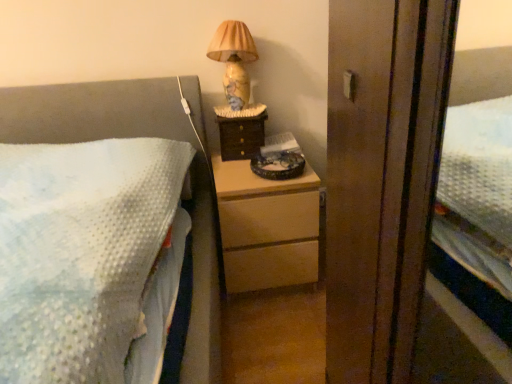
Question: Considering the relative positions of wooden drawer at center and light wood chest of drawers at center in the image provided, is wooden drawer at center to the right of light wood chest of drawers at center from the viewer's perspective?

Choices:
 (A) yes
 (B) no

Answer: (B)

Question: Are wooden drawer at center and light wood chest of drawers at center far apart?

Choices:
 (A) no
 (B) yes

Answer: (A)

Question: From the image's perspective, does wooden drawer at center appear lower than light wood chest of drawers at center?

Choices:
 (A) no
 (B) yes

Answer: (A)

Question: Considering the relative sizes of wooden drawer at center and light wood chest of drawers at center in the image provided, is wooden drawer at center wider than light wood chest of drawers at center?

Choices:
 (A) yes
 (B) no

Answer: (B)

Question: Could light wood chest of drawers at center be considered to be inside wooden drawer at center?

Choices:
 (A) no
 (B) yes

Answer: (A)

Question: Is light wood chest of drawers at center inside the boundaries of marble-patterned lampshade at upper right, or outside?

Choices:
 (A) inside
 (B) outside

Answer: (B)

Question: Based on their sizes in the image, would you say light wood chest of drawers at center is bigger or smaller than marble-patterned lampshade at upper right?

Choices:
 (A) big
 (B) small

Answer: (A)

Question: Is light wood chest of drawers at center taller or shorter than marble-patterned lampshade at upper right?

Choices:
 (A) short
 (B) tall

Answer: (B)

Question: Relative to marble-patterned lampshade at upper right, is light wood chest of drawers at center in front or behind?

Choices:
 (A) front
 (B) behind

Answer: (A)

Question: Choose the correct answer: Is wooden drawer at center inside light wood chest of drawers at center or outside it?

Choices:
 (A) inside
 (B) outside

Answer: (B)

Question: From a real-world perspective, relative to light wood chest of drawers at center, is wooden drawer at center vertically above or below?

Choices:
 (A) above
 (B) below

Answer: (A)

Question: Based on their sizes in the image, would you say wooden drawer at center is bigger or smaller than light wood chest of drawers at center?

Choices:
 (A) small
 (B) big

Answer: (A)

Question: Considering their positions, is wooden drawer at center located in front of or behind light wood chest of drawers at center?

Choices:
 (A) behind
 (B) front

Answer: (A)

Question: Is light wood chest of drawers at center in front of or behind wooden drawer at center in the image?

Choices:
 (A) behind
 (B) front

Answer: (B)

Question: From the image's perspective, relative to wooden drawer at center, is light wood chest of drawers at center above or below?

Choices:
 (A) above
 (B) below

Answer: (B)